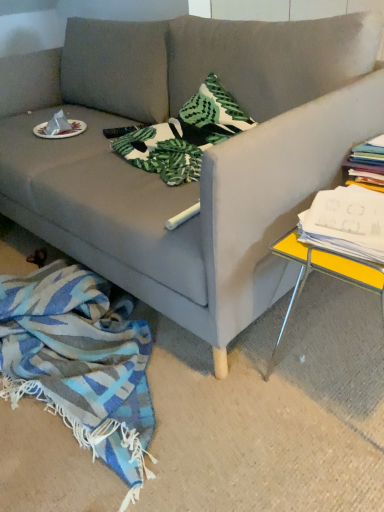
Question: Is white paper plate at upper left thinner than blue woven blanket at lower left?

Choices:
 (A) no
 (B) yes

Answer: (B)

Question: Is white paper plate at upper left placed right next to blue woven blanket at lower left?

Choices:
 (A) no
 (B) yes

Answer: (A)

Question: Can you confirm if white paper plate at upper left is taller than blue woven blanket at lower left?

Choices:
 (A) yes
 (B) no

Answer: (B)

Question: Is white paper plate at upper left further to the viewer compared to blue woven blanket at lower left?

Choices:
 (A) no
 (B) yes

Answer: (B)

Question: Is blue woven blanket at lower left completely or partially inside white paper plate at upper left?

Choices:
 (A) yes
 (B) no

Answer: (B)

Question: Is white paper plate at upper left to the left of blue woven blanket at lower left from the viewer's perspective?

Choices:
 (A) yes
 (B) no

Answer: (A)

Question: Can you confirm if matte gray couch at center is shorter than white paper plate at upper left?

Choices:
 (A) yes
 (B) no

Answer: (A)

Question: From a real-world perspective, is matte gray couch at center located beneath white paper plate at upper left?

Choices:
 (A) no
 (B) yes

Answer: (B)

Question: Does matte gray couch at center have a greater width compared to white paper plate at upper left?

Choices:
 (A) no
 (B) yes

Answer: (B)

Question: Does matte gray couch at center lie in front of white paper plate at upper left?

Choices:
 (A) no
 (B) yes

Answer: (B)

Question: Is white paper plate at upper left at the back of matte gray couch at center?

Choices:
 (A) yes
 (B) no

Answer: (B)

Question: Is matte gray couch at center outside white paper plate at upper left?

Choices:
 (A) no
 (B) yes

Answer: (B)

Question: Does matte gray couch at center have a lesser width compared to white paper stack at right?

Choices:
 (A) yes
 (B) no

Answer: (B)